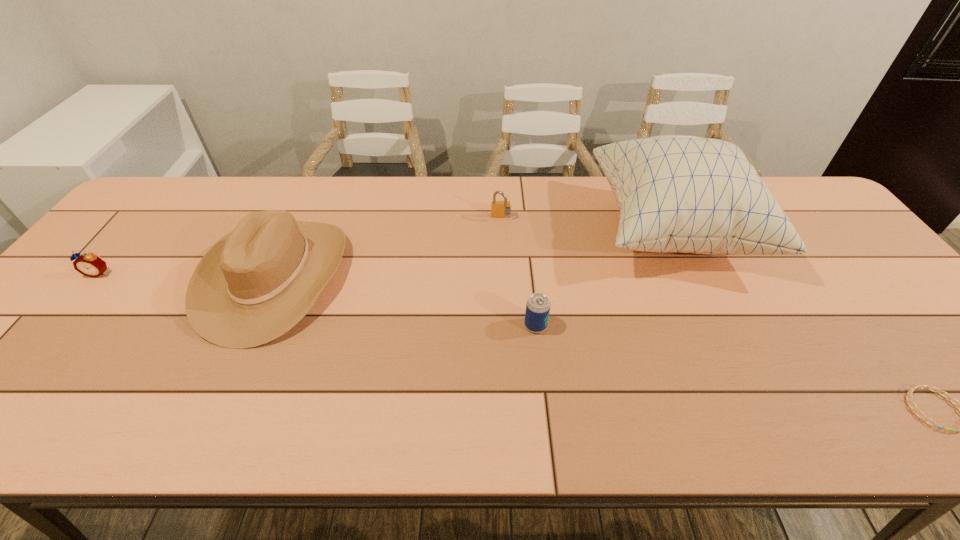
Locate an element on the screen. The image size is (960, 540). free region located 0.170m on the back of the third object from right to left is located at coordinates (529, 268).

This screenshot has width=960, height=540. I want to click on free space located 0.270m on the front-facing side of the leftmost object, so click(x=21, y=366).

Identify the location of cushion that is at the far edge. coord(700,195).

What are the coordinates of `cowboy hat at the far edge` in the screenshot? It's located at (253, 285).

Locate an element on the screen. padlock that is at the far edge is located at coordinates (499, 209).

Where is `object positioned at the left edge`? The image size is (960, 540). object positioned at the left edge is located at coordinates (88, 264).

You are a GUI agent. You are given a task and a screenshot of the screen. Output one action in this format:
    pyautogui.click(x=<x>, y=<y>)
    Task: Click on the vacant space at the far edge
    
    Given the screenshot: What is the action you would take?
    pyautogui.click(x=547, y=189)

You are a GUI agent. You are given a task and a screenshot of the screen. Output one action in this format:
    pyautogui.click(x=<x>, y=<y>)
    Task: Click on the vacant space at the near edge
    This screenshot has height=540, width=960.
    Given the screenshot: What is the action you would take?
    pyautogui.click(x=234, y=431)

This screenshot has width=960, height=540. I want to click on vacant space at the left edge of the desktop, so click(91, 314).

In the image, there is a desktop. Identify the location of free space at the far right corner. The image size is (960, 540). (779, 185).